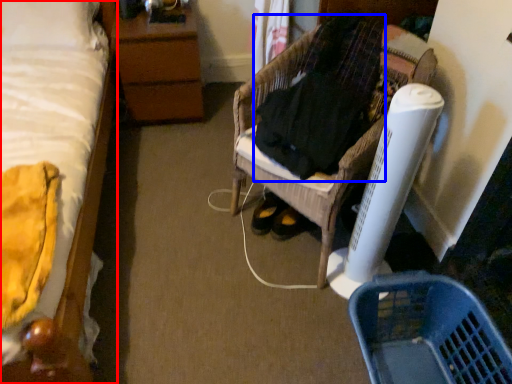
Question: Among these objects, which one is farthest to the camera, bed (highlighted by a red box) or clothing (highlighted by a blue box)?

Choices:
 (A) bed
 (B) clothing

Answer: (B)